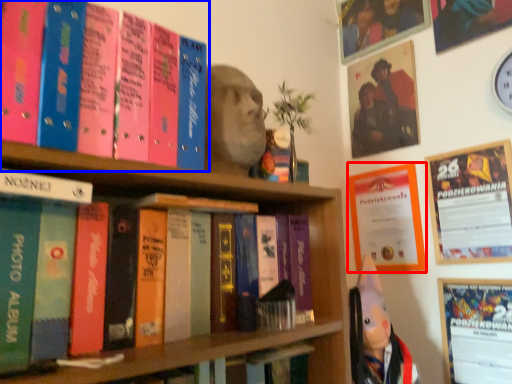
Question: Among these objects, which one is farthest to the camera, poster page (highlighted by a red box) or book (highlighted by a blue box)?

Choices:
 (A) poster page
 (B) book

Answer: (A)